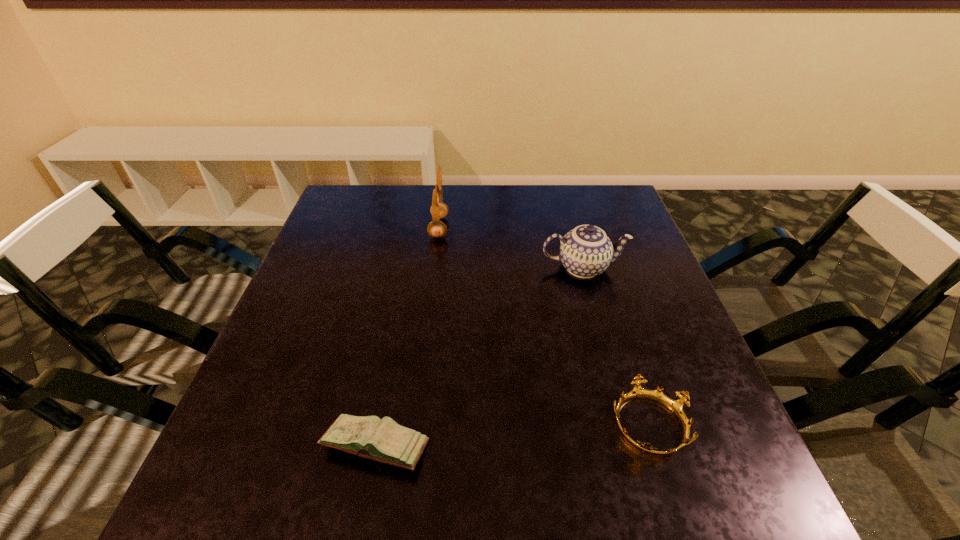
Where is `object present at the far edge`? This screenshot has width=960, height=540. object present at the far edge is located at coordinates (436, 228).

The image size is (960, 540). Identify the location of object that is at the near edge. (383, 440).

At what (x,y) coordinates should I click in order to perform the action: click on chinaware that is at the right edge. Please return your answer as a coordinate pair (x, y). Looking at the image, I should click on (586, 251).

At what (x,y) coordinates should I click in order to perform the action: click on crown situated at the right edge. Please return your answer as a coordinate pair (x, y). This screenshot has height=540, width=960. Looking at the image, I should click on (676, 407).

Where is `vacant space at the far edge of the desktop`? vacant space at the far edge of the desktop is located at coordinates (473, 200).

Where is `blank space at the left edge of the desktop`? blank space at the left edge of the desktop is located at coordinates (342, 266).

Image resolution: width=960 pixels, height=540 pixels. What are the coordinates of `free space at the right edge` in the screenshot? It's located at (725, 416).

In the image, there is a desktop. At what (x,y) coordinates should I click in order to perform the action: click on vacant region at the far right corner. Please return your answer as a coordinate pair (x, y). The image size is (960, 540). Looking at the image, I should click on (613, 195).

At what (x,y) coordinates should I click in order to perform the action: click on vacant area at the near right corner. Please return your answer as a coordinate pair (x, y). This screenshot has width=960, height=540. Looking at the image, I should click on click(728, 510).

You are a GUI agent. You are given a task and a screenshot of the screen. Output one action in this format:
    pyautogui.click(x=<x>, y=<y>)
    Task: Click on the free point between the earphone and the chinaware
    
    Given the screenshot: What is the action you would take?
    pyautogui.click(x=511, y=247)